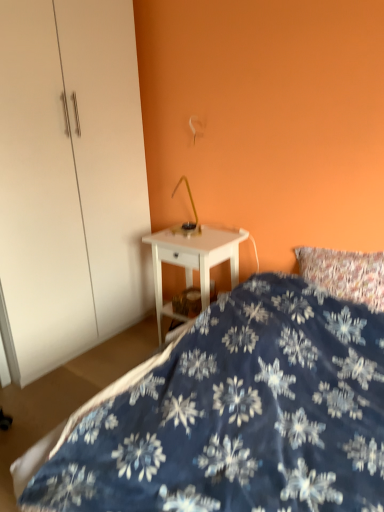
Question: From a real-world perspective, is white glossy dresser at center physically located above or below white glossy nightstand at center?

Choices:
 (A) below
 (B) above

Answer: (B)

Question: Would you say white glossy dresser at center is to the left or to the right of white glossy nightstand at center in the picture?

Choices:
 (A) left
 (B) right

Answer: (A)

Question: Which object is the farthest from the white glossy dresser at center?

Choices:
 (A) blue fabric bed at lower right
 (B) white glossy nightstand at center

Answer: (A)

Question: Which object is the farthest from the white glossy nightstand at center?

Choices:
 (A) blue fabric bed at lower right
 (B) white glossy dresser at center

Answer: (A)